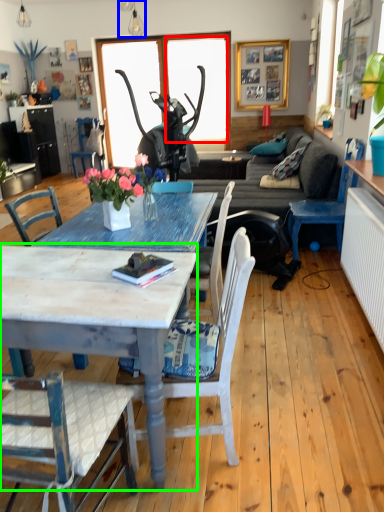
Question: Considering the real-world distances, which object is closest to window screen (highlighted by a red box)? lamp (highlighted by a blue box) or coffee table (highlighted by a green box).

Choices:
 (A) lamp
 (B) coffee table

Answer: (A)